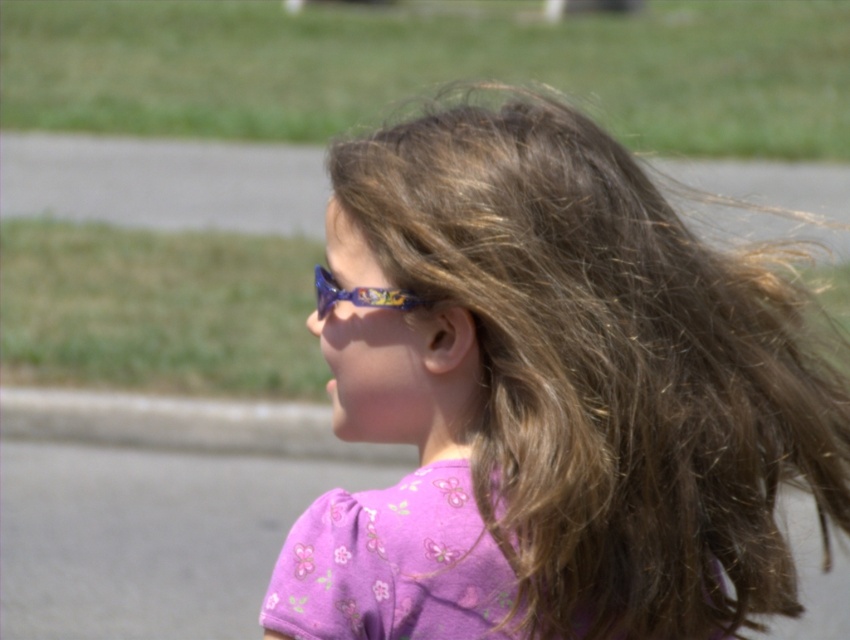
Question: Is purple fabric shirt at center to the left of shiny blue plastic goggles at center from the viewer's perspective?

Choices:
 (A) yes
 (B) no

Answer: (B)

Question: Can you confirm if purple fabric shirt at center is smaller than shiny blue plastic goggles at center?

Choices:
 (A) no
 (B) yes

Answer: (A)

Question: Which of the following is the farthest from the observer?

Choices:
 (A) (323, 289)
 (B) (432, 621)

Answer: (A)

Question: Which point is farther from the camera taking this photo?

Choices:
 (A) (698, 326)
 (B) (420, 304)

Answer: (A)

Question: Can you confirm if purple fabric shirt at center is positioned above shiny blue plastic goggles at center?

Choices:
 (A) no
 (B) yes

Answer: (A)

Question: Which point is closer to the camera?

Choices:
 (A) (452, 387)
 (B) (384, 304)

Answer: (B)